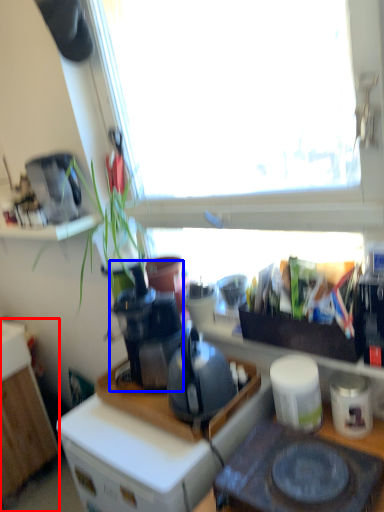
Question: Which object is closer to the camera taking this photo, cabinetry (highlighted by a red box) or coffee machine (highlighted by a blue box)?

Choices:
 (A) cabinetry
 (B) coffee machine

Answer: (B)